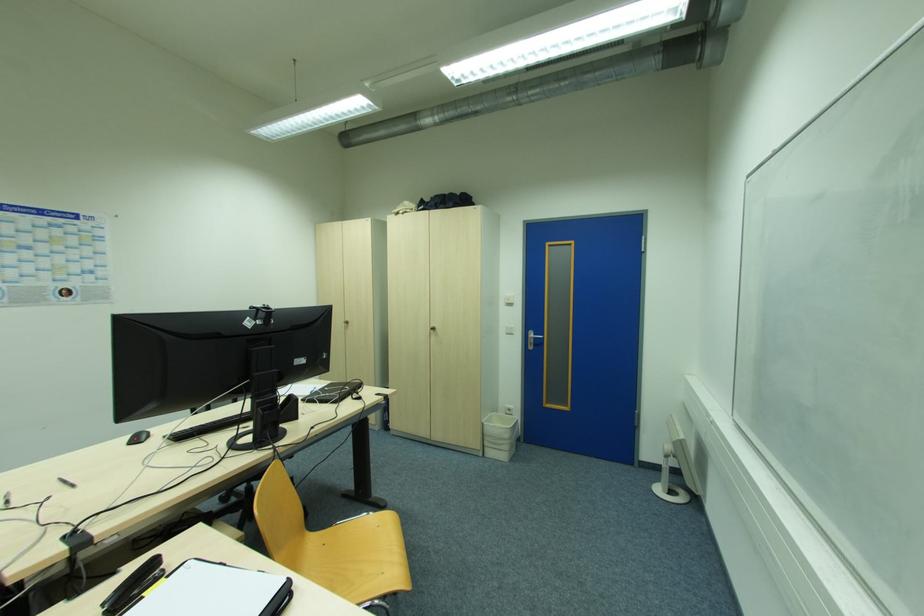
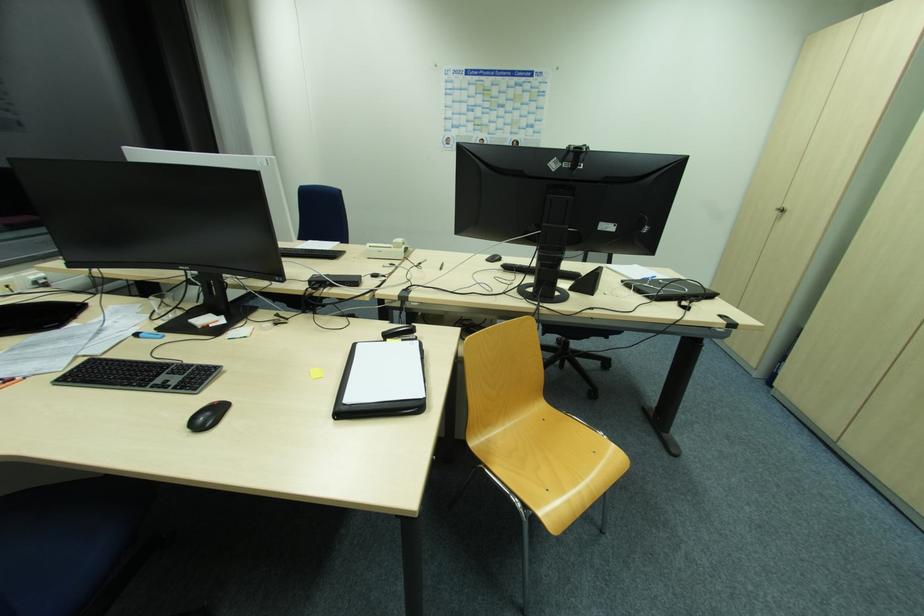
Where in the second image is the point corresponding to pixel 346 325 from the first image?

(779, 214)